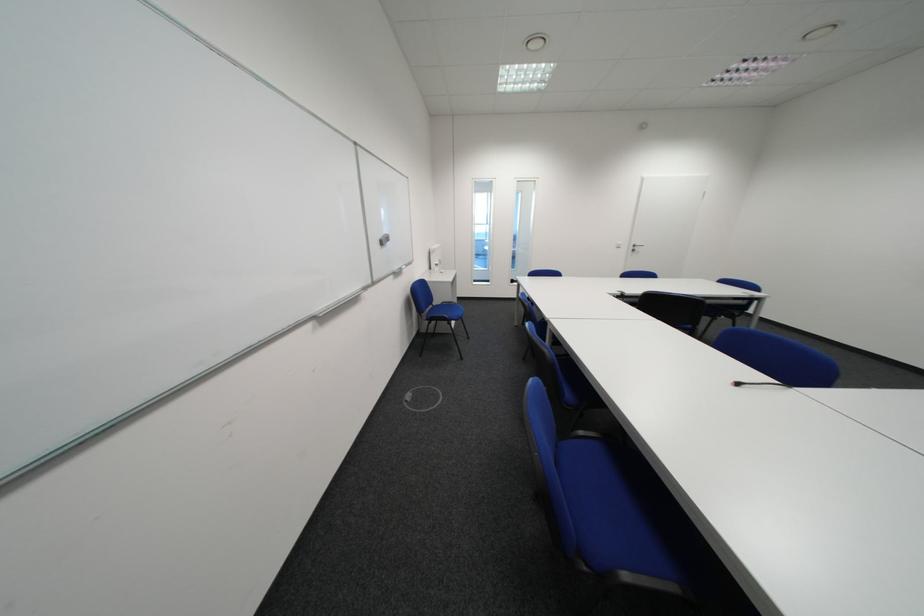
Which object does [322,312] point to?

It corresponds to the whiteboard eraser in the image.